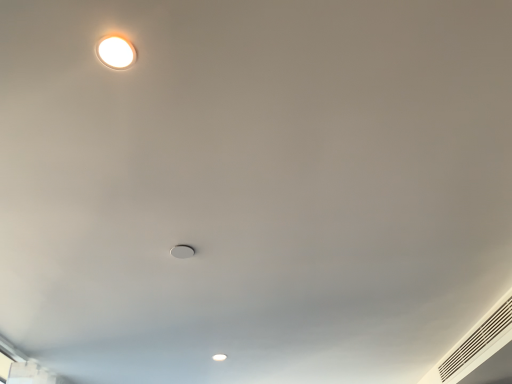
Question: Considering the relative sizes of white textured vent at lower right and matte white lamp at upper left in the image provided, is white textured vent at lower right bigger than matte white lamp at upper left?

Choices:
 (A) yes
 (B) no

Answer: (A)

Question: From a real-world perspective, does white textured vent at lower right sit lower than matte white lamp at upper left?

Choices:
 (A) no
 (B) yes

Answer: (B)

Question: Is white textured vent at lower right at the right side of matte white lamp at upper left?

Choices:
 (A) no
 (B) yes

Answer: (B)

Question: Is white textured vent at lower right not near matte white lamp at upper left?

Choices:
 (A) no
 (B) yes

Answer: (B)

Question: Is white textured vent at lower right closer to the viewer compared to matte white lamp at upper left?

Choices:
 (A) yes
 (B) no

Answer: (B)

Question: Is white textured vent at lower right behind matte white lamp at upper left?

Choices:
 (A) yes
 (B) no

Answer: (A)

Question: Does matte white lamp at upper left appear on the left side of white textured vent at lower right?

Choices:
 (A) yes
 (B) no

Answer: (A)

Question: Is matte white lamp at upper left outside white textured vent at lower right?

Choices:
 (A) yes
 (B) no

Answer: (A)

Question: Is matte white lamp at upper left thinner than white textured vent at lower right?

Choices:
 (A) no
 (B) yes

Answer: (A)

Question: From a real-world perspective, is matte white lamp at upper left physically below white textured vent at lower right?

Choices:
 (A) yes
 (B) no

Answer: (B)

Question: Considering the relative positions of matte white lamp at upper left and white textured vent at lower right in the image provided, is matte white lamp at upper left to the right of white textured vent at lower right from the viewer's perspective?

Choices:
 (A) no
 (B) yes

Answer: (A)

Question: Is matte white lamp at upper left wider than white textured vent at lower right?

Choices:
 (A) yes
 (B) no

Answer: (A)

Question: From a real-world perspective, is matte white lamp at upper left above or below white textured vent at lower right?

Choices:
 (A) below
 (B) above

Answer: (B)